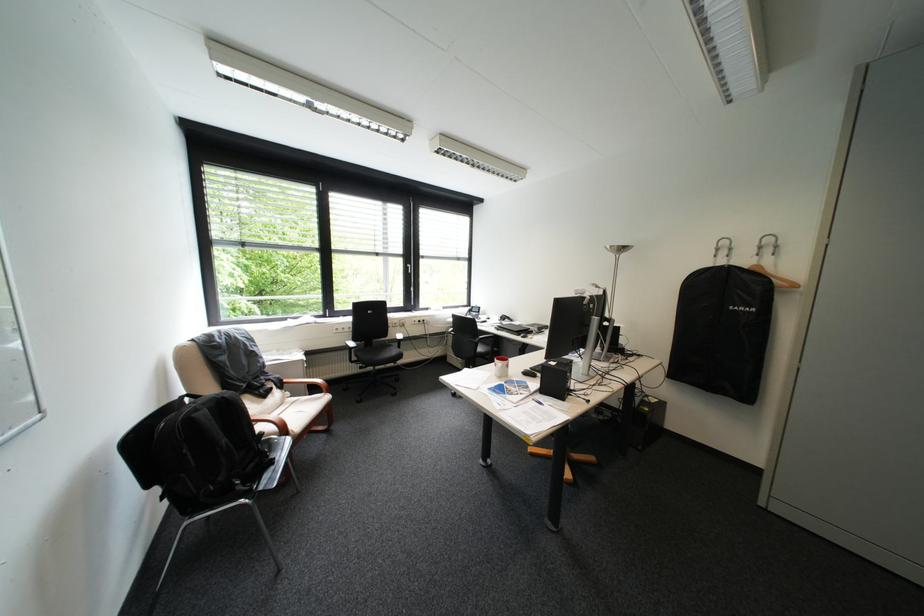
I want to click on red and white mug, so click(501, 367).